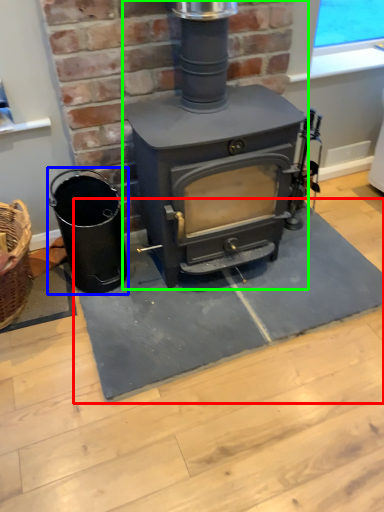
Question: Which object is positioned closest to doormat (highlighted by a red box)? Select from appliance (highlighted by a blue box) and wood burning stove (highlighted by a green box).

Choices:
 (A) appliance
 (B) wood burning stove

Answer: (A)